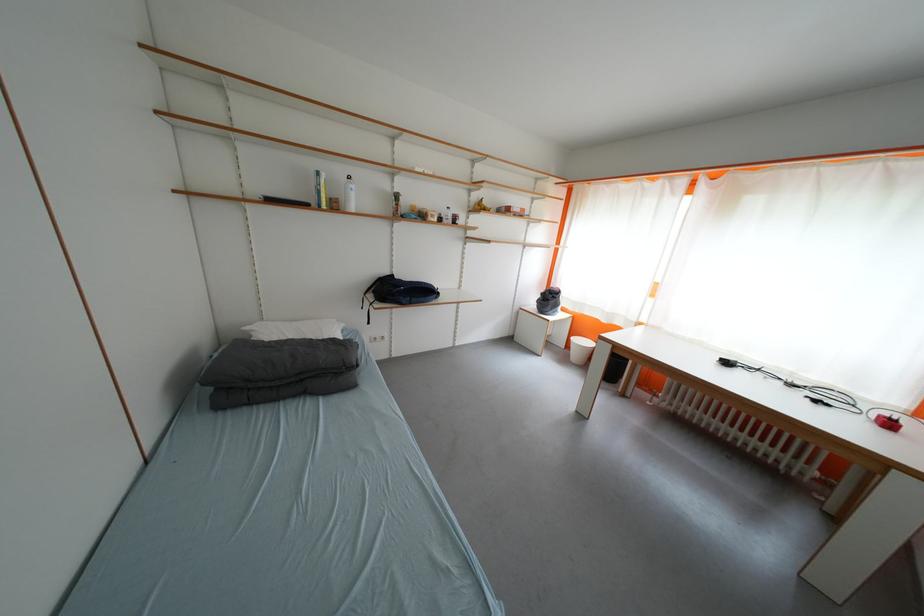
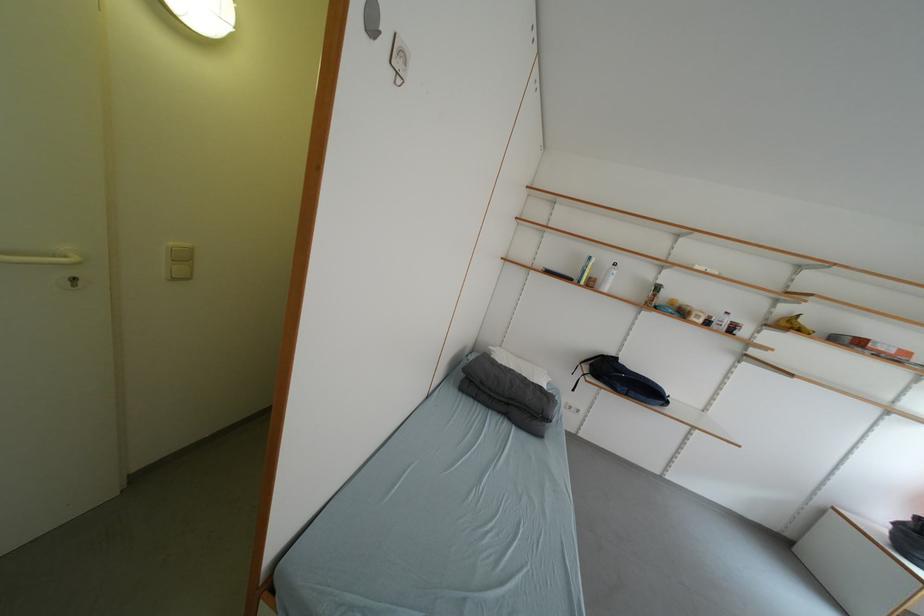
Question: The camera is either moving clockwise (left) or counter-clockwise (right) around the object. The first image is from the beginning of the video and the second image is from the end. Is the camera moving left or right when shooting the video?

Choices:
 (A) Left
 (B) Right

Answer: (B)